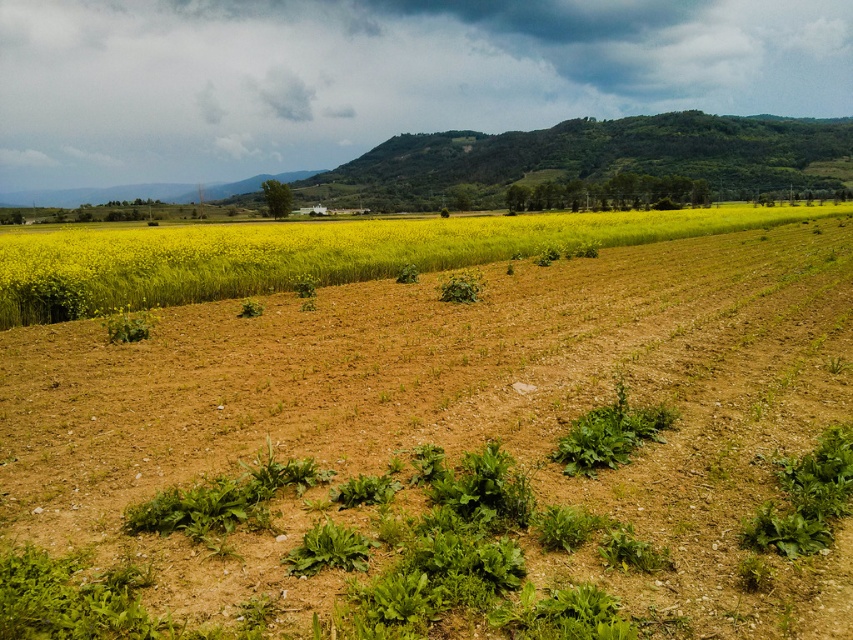
Which is more to the right, yellow grass at upper left or green leafy plant at center?

Positioned to the right is green leafy plant at center.

Who is lower down, yellow grass at upper left or green leafy plant at center?

green leafy plant at center is below.

Is point (322, 241) less distant than point (653, 422)?

No, (322, 241) is behind (653, 422).

Locate an element on the screen. This screenshot has height=640, width=853. yellow grass at upper left is located at coordinates (310, 253).

Does brown soil at center have a smaller size compared to green leafy plant at center?

No.

Does point (207, 348) lie in front of point (575, 426)?

No.

This screenshot has width=853, height=640. Find the location of `brown soil at center`. brown soil at center is located at coordinates (436, 448).

Which is more to the left, brown soil at center or yellow grass at upper left?

From the viewer's perspective, yellow grass at upper left appears more on the left side.

Can you confirm if brown soil at center is wider than yellow grass at upper left?

Incorrect, brown soil at center's width does not surpass yellow grass at upper left's.

Which is in front, point (781, 492) or point (447, 248)?

Point (781, 492) is in front.

You are a GUI agent. You are given a task and a screenshot of the screen. Output one action in this format:
    pyautogui.click(x=<x>, y=<y>)
    Task: Click on the brown soil at center
    The image size is (853, 640).
    Given the screenshot: What is the action you would take?
    pyautogui.click(x=436, y=448)